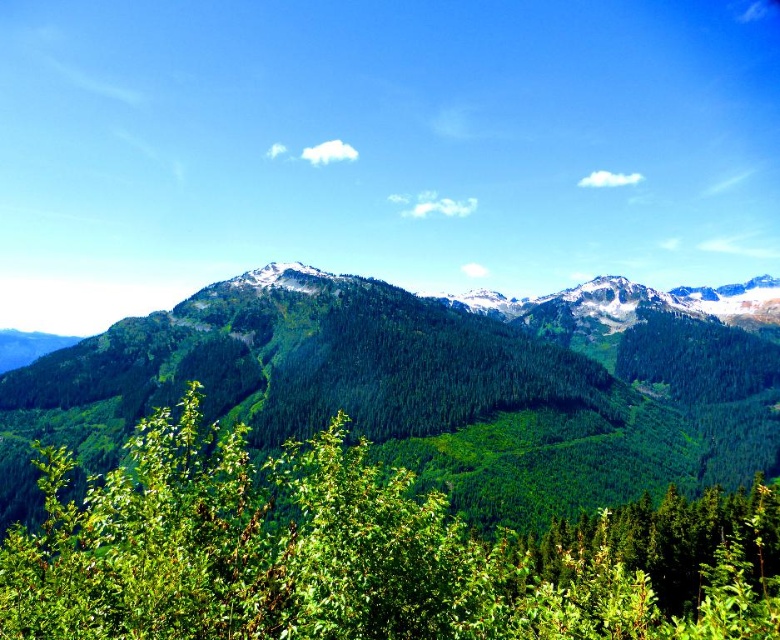
Can you confirm if green forested mountain range at center is thinner than green leafy tree at center?

Incorrect, green forested mountain range at center's width is not less than green leafy tree at center's.

Does green forested mountain range at center come behind green leafy tree at center?

Yes, it is.

Is point (594, 500) positioned in front of point (90, 536)?

No, (594, 500) is behind (90, 536).

Where is `green forested mountain range at center`? This screenshot has width=780, height=640. green forested mountain range at center is located at coordinates (424, 388).